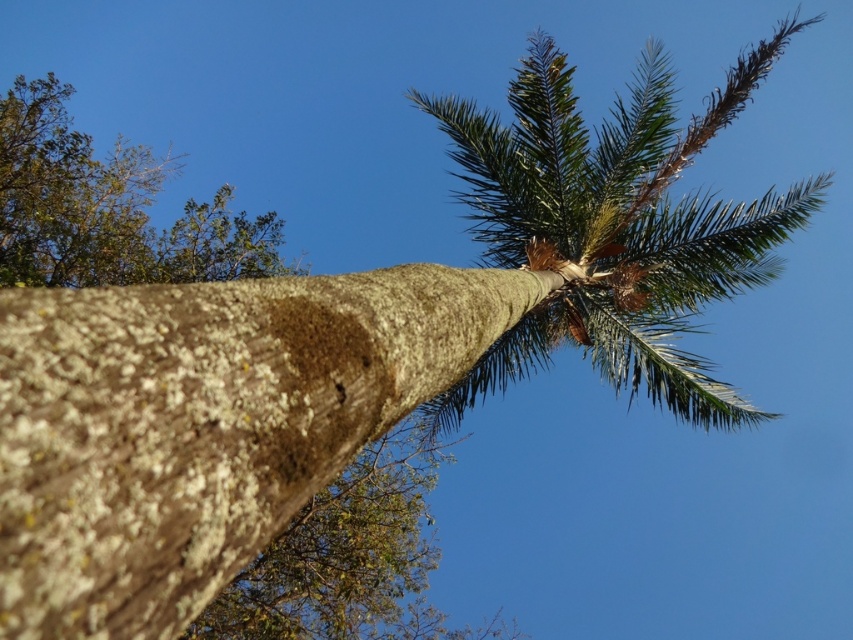
Which is in front, point (334, 460) or point (154, 250)?

Point (334, 460)

Does brown rough bark at center appear on the left side of green leafy tree at upper left?

Incorrect, brown rough bark at center is not on the left side of green leafy tree at upper left.

Which is behind, point (16, 531) or point (38, 182)?

Point (38, 182)

Locate an element on the screen. brown rough bark at center is located at coordinates [204, 424].